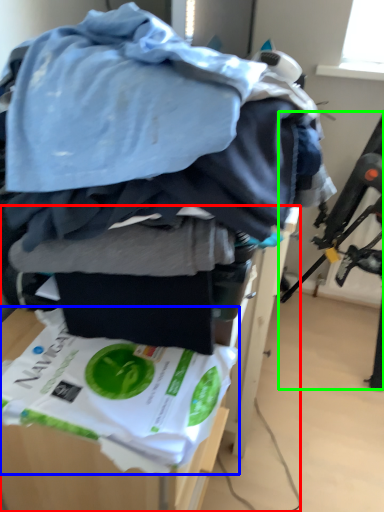
Question: Which object is positioned farthest from furniture (highlighted by a red box)? Select from waste (highlighted by a blue box) and swivel chair (highlighted by a green box).

Choices:
 (A) waste
 (B) swivel chair

Answer: (B)